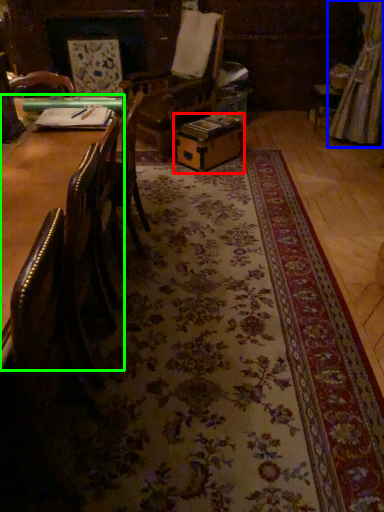
Question: Considering the real-world distances, which object is closest to cardboard box (highlighted by a red box)? curtain (highlighted by a blue box) or table (highlighted by a green box).

Choices:
 (A) curtain
 (B) table

Answer: (A)